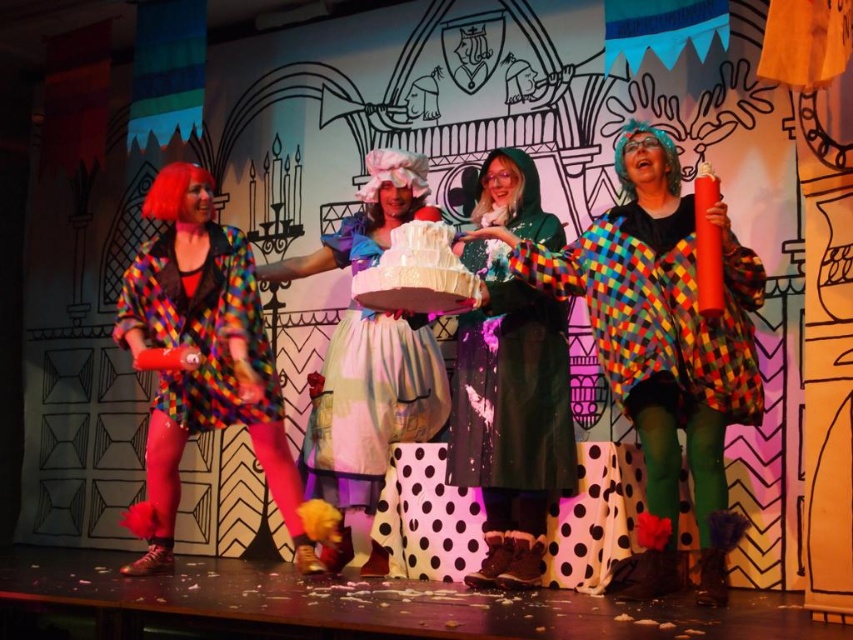
Who is more distant from viewer, (640,275) or (482,244)?

Point (482,244)

Can you confirm if multicolored patchwork coat at right is positioned below green woolen coat at center?

Yes.

Identify the location of multicolored patchwork coat at right. (663, 340).

The height and width of the screenshot is (640, 853). I want to click on multicolored patchwork coat at right, so click(x=663, y=340).

Find the location of a particular element. The image size is (853, 640). multicolored patchwork coat at right is located at coordinates (663, 340).

Can you confirm if multicolored patchwork coat at right is positioned to the left of white polka dot skirt at center?

Incorrect, multicolored patchwork coat at right is not on the left side of white polka dot skirt at center.

Between point (697, 388) and point (329, 406), which one is positioned behind?

Point (329, 406)

Where is `multicolored patchwork coat at right`? The width and height of the screenshot is (853, 640). multicolored patchwork coat at right is located at coordinates (663, 340).

Is point (223, 323) in front of point (402, 385)?

That is True.

Is multicolored fabric dress at left wider than matte white dress at center?

In fact, multicolored fabric dress at left might be narrower than matte white dress at center.

Is point (201, 390) behind point (409, 189)?

No, (201, 390) is in front of (409, 189).

At what (x,y) coordinates should I click in order to perform the action: click on multicolored fabric dress at left. Please return your answer as a coordinate pair (x, y). This screenshot has width=853, height=640. Looking at the image, I should click on (200, 358).